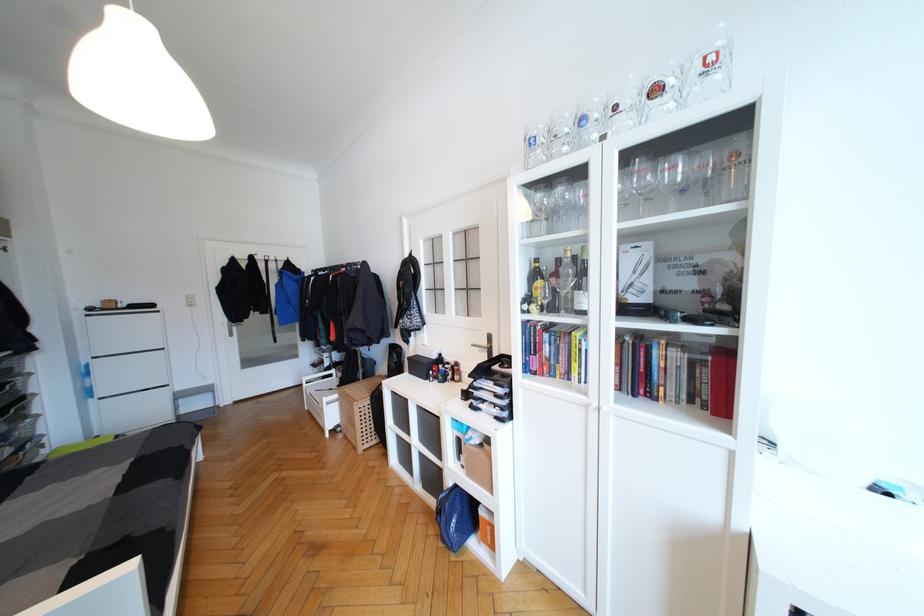
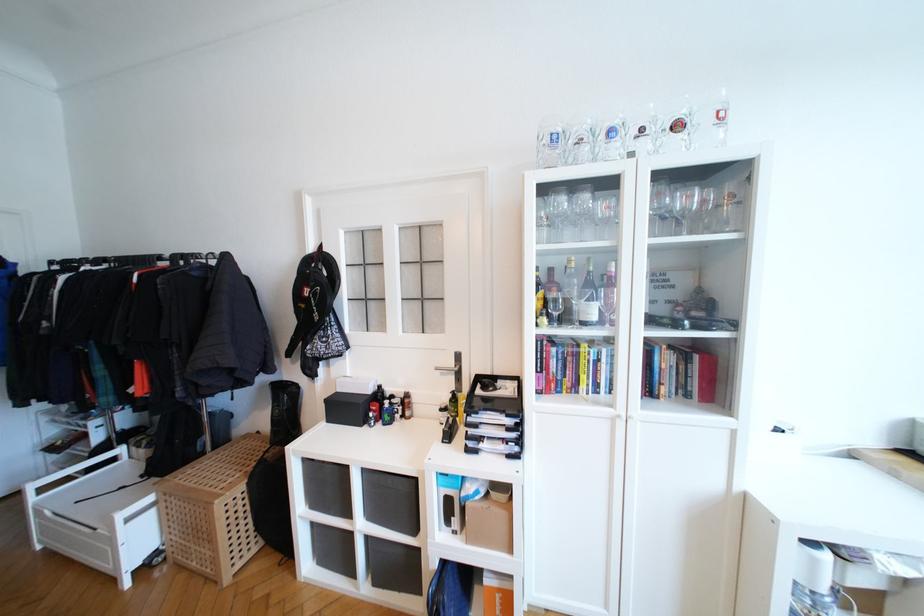
Where in the second image is the point corresponding to point 372,440 from the first image?

(248, 551)